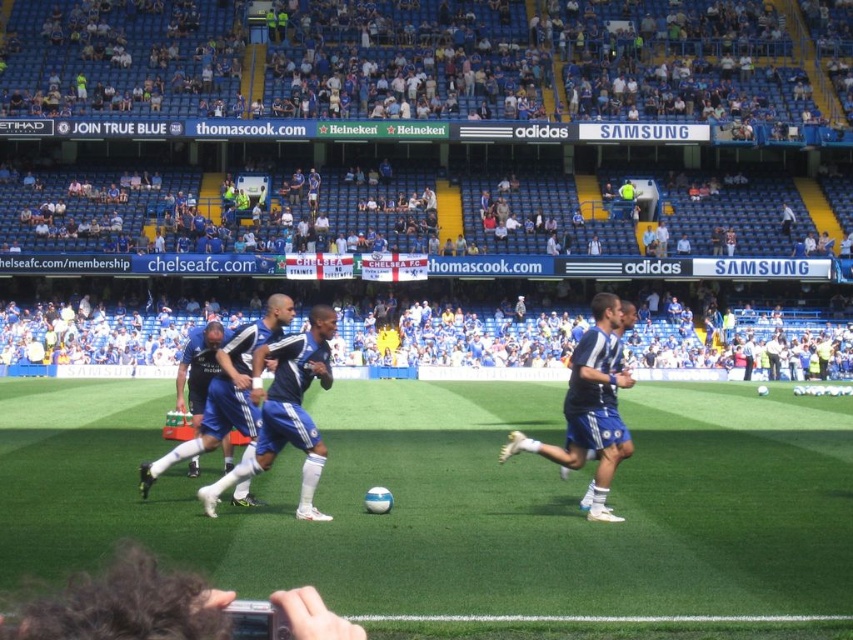
Question: Does blue fabric jersey at center have a smaller size compared to blue fabric shorts at right?

Choices:
 (A) yes
 (B) no

Answer: (B)

Question: Which of the following is the farthest from the observer?

Choices:
 (A) green artificial turf at center
 (B) blue fabric jersey at center

Answer: (B)

Question: Which object is closer to the camera taking this photo?

Choices:
 (A) blue fabric jersey at center
 (B) green artificial turf at center

Answer: (B)

Question: Is blue fabric jersey at center bigger than blue fabric shorts at right?

Choices:
 (A) no
 (B) yes

Answer: (B)

Question: Does green artificial turf at center appear on the right side of blue fabric jersey at center?

Choices:
 (A) no
 (B) yes

Answer: (B)

Question: Which point is closer to the camera?

Choices:
 (A) (250, 380)
 (B) (515, 436)

Answer: (A)